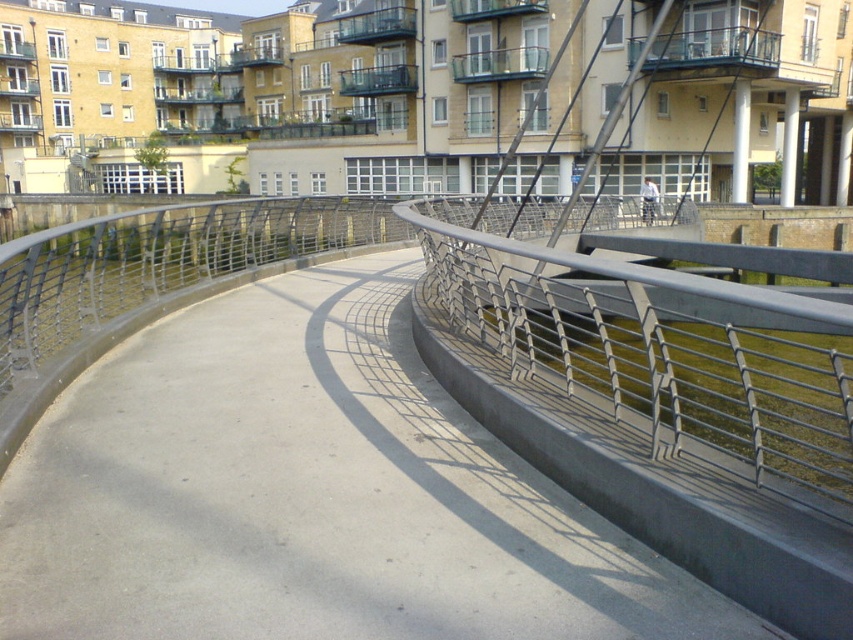
Question: Which point is farther to the camera?

Choices:
 (A) (386, 289)
 (B) (715, 358)

Answer: (A)

Question: Considering the relative positions of smooth concrete path at center and metallic gray railing at center in the image provided, where is smooth concrete path at center located with respect to metallic gray railing at center?

Choices:
 (A) above
 (B) below

Answer: (B)

Question: Which of the following is the farthest from the observer?

Choices:
 (A) smooth concrete path at center
 (B) metallic gray railing at center

Answer: (A)

Question: Is smooth concrete path at center to the left of metallic gray railing at center from the viewer's perspective?

Choices:
 (A) no
 (B) yes

Answer: (B)

Question: Does smooth concrete path at center have a larger size compared to metallic gray railing at center?

Choices:
 (A) yes
 (B) no

Answer: (B)